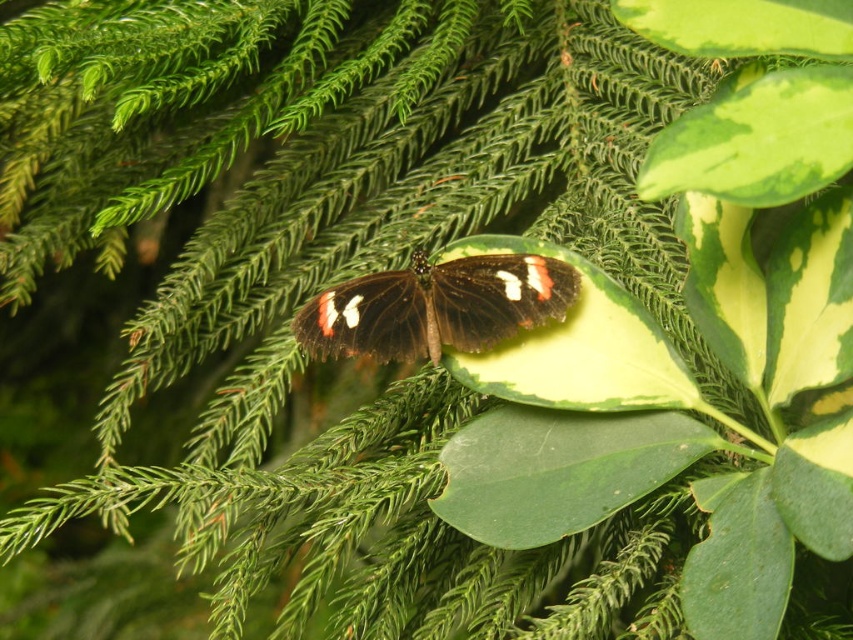
You are observing the butterfly and the leaf in the image. Which of the two points, point (659,451) or point (804,164), is closer to you?

Point (659,451) is closer to you because it is further to the viewer than point (804,164).

You are an entomologist observing the scene. You notice the black glossy butterfly at center and the green glossy leaf at upper right. Which object is positioned higher in the image?

The green glossy leaf at upper right is positioned higher than the black glossy butterfly at center.

You are an entomologist observing a butterfly and its resting place. You notice the green glossy leaf at center and the black glossy butterfly at center. Which object is smaller in size?

The green glossy leaf at center is smaller in size compared to the black glossy butterfly at center.